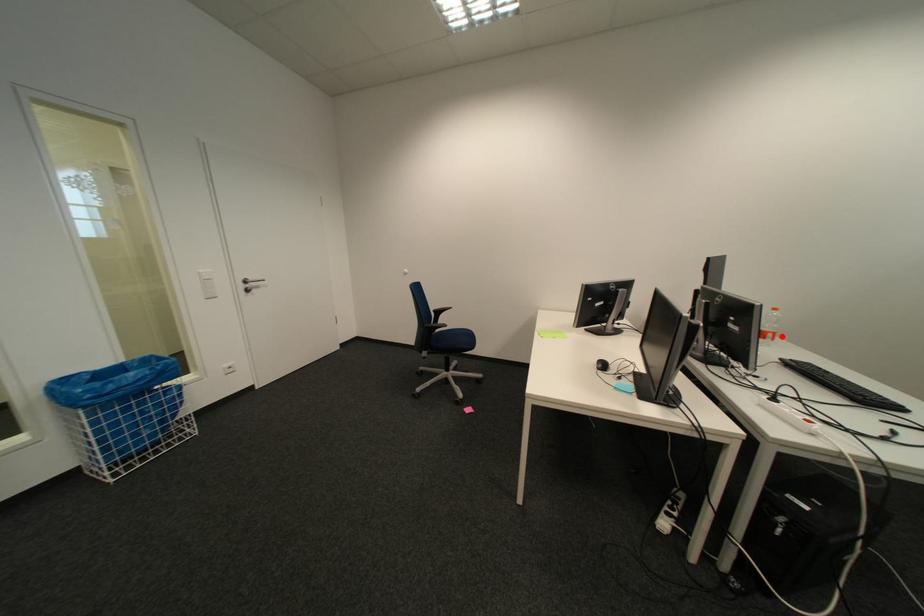
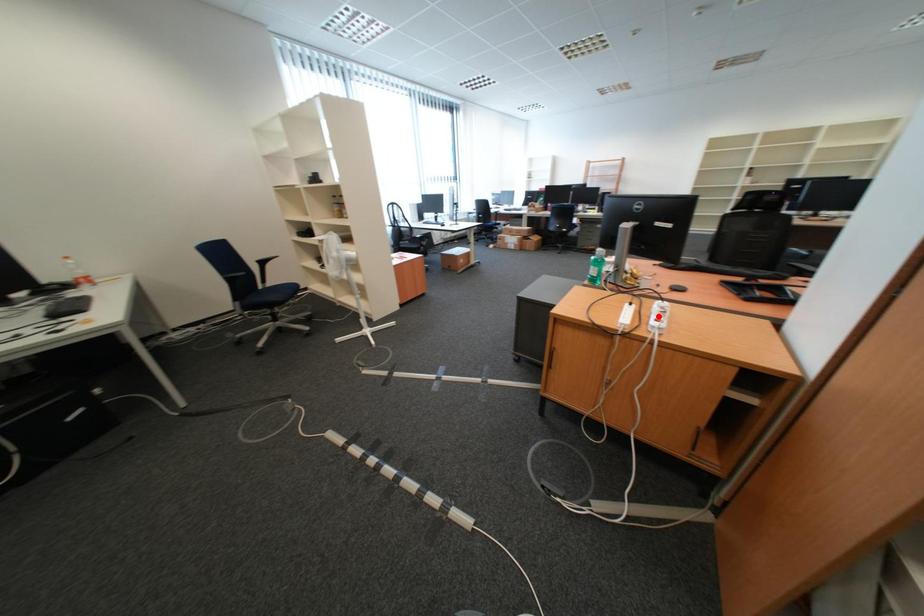
I am providing you with two images of the same scene from different viewpoints. A red point is marked on the first image and another point is marked on the second image. Do the highlighted points in image1 and image2 indicate the same real-world spot?

No